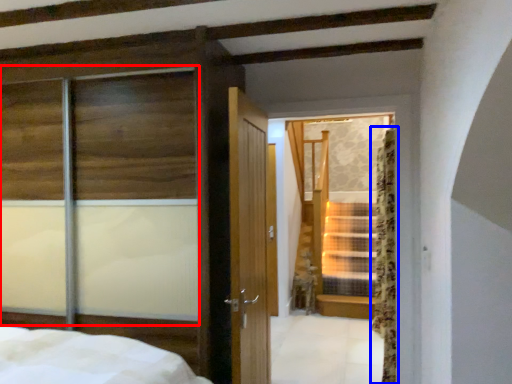
Question: Which object is closer to the camera taking this photo, window (highlighted by a red box) or curtain (highlighted by a blue box)?

Choices:
 (A) window
 (B) curtain

Answer: (A)